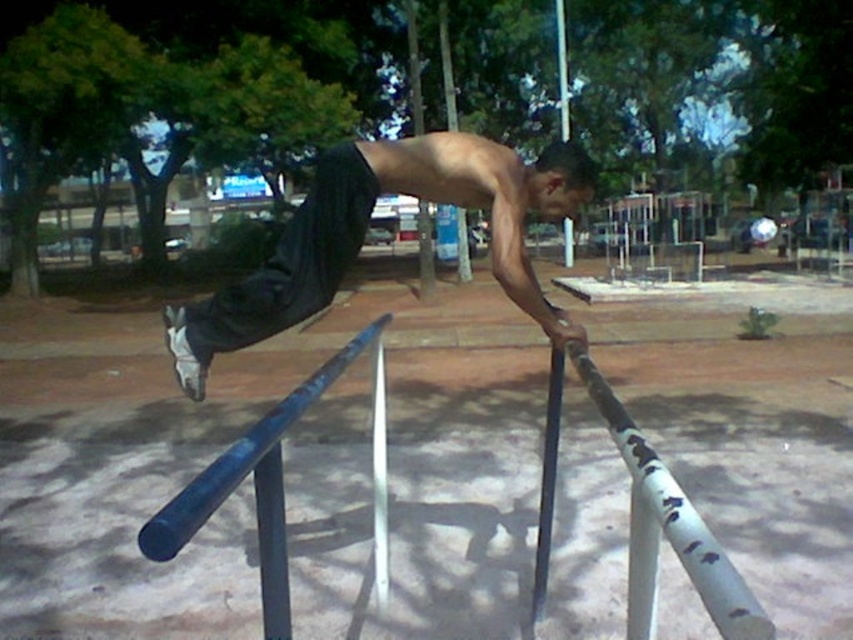
You are a photographer positioned at the center of the scene. You want to capture a closeup of both point (x=502, y=161) and point (x=556, y=451) in your camera frame. Which point should you focus on first to ensure both are in focus?

You should focus on point (x=502, y=161) first because it is closer to the viewer than point (x=556, y=451). By focusing on the closer point, the farther point will also be within the depth of field, ensuring both are in focus.